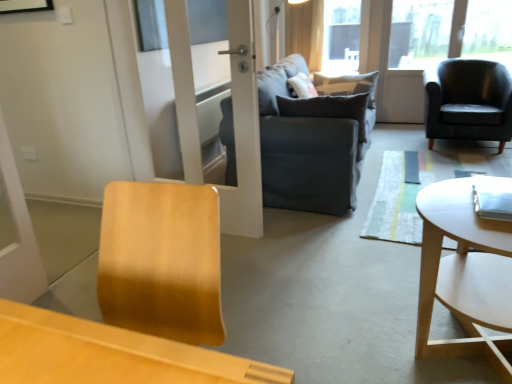
You are a GUI agent. You are given a task and a screenshot of the screen. Output one action in this format:
    pyautogui.click(x=<x>, y=<y>)
    Task: Click on the free spot above white wood coffee table at right (from a real-world perspective)
    The height and width of the screenshot is (384, 512).
    Given the screenshot: What is the action you would take?
    pyautogui.click(x=464, y=206)